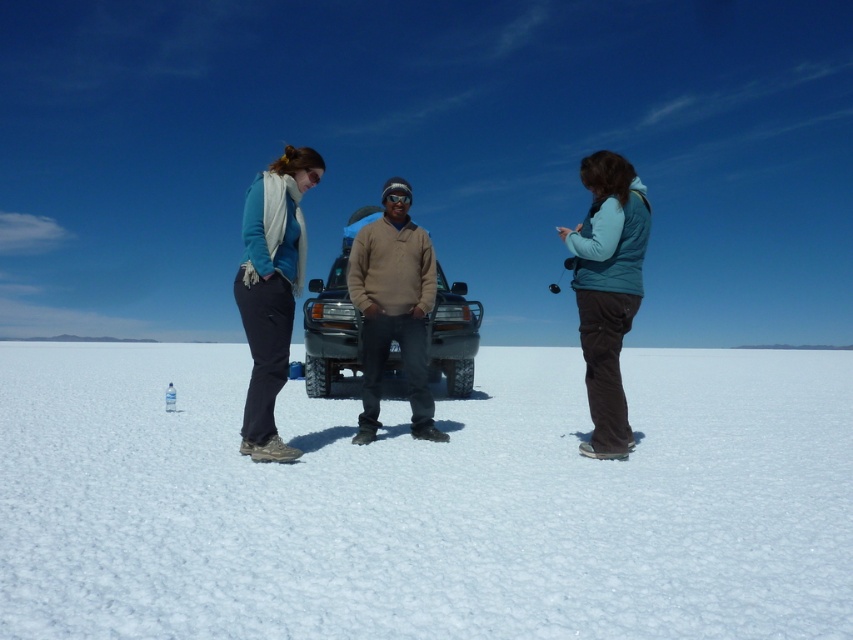
Question: Which point appears farthest from the camera in this image?

Choices:
 (A) (358, 257)
 (B) (645, 230)

Answer: (A)

Question: Does white crystalline snow at center appear over matte blue sweater at center?

Choices:
 (A) no
 (B) yes

Answer: (A)

Question: Does white crystalline snow at center have a larger size compared to matte blue sweater at center?

Choices:
 (A) no
 (B) yes

Answer: (B)

Question: Which object is the closest to the teal fleece vest at center?

Choices:
 (A) matte black jeep at center
 (B) white crystalline snow at center

Answer: (A)

Question: Which point is closer to the camera taking this photo?

Choices:
 (A) (358, 339)
 (B) (412, 314)

Answer: (B)

Question: Is teal fleece vest at center below matte black jeep at center?

Choices:
 (A) yes
 (B) no

Answer: (B)